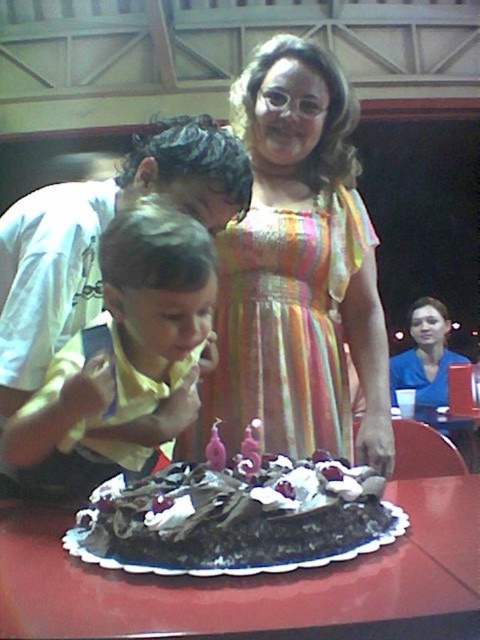
Question: Which point is closer to the camera taking this photo?

Choices:
 (A) (255, 90)
 (B) (216, 433)

Answer: (B)

Question: Estimate the real-world distances between objects in this image. Which object is farther from the matte yellow shirt at left?

Choices:
 (A) multicolored striped dress at center
 (B) chocolate cake at center
 (C) pink wax candle at center
 (D) chocolate frosted cake at center

Answer: (A)

Question: Which object is positioned farthest from the chocolate cake at center?

Choices:
 (A) pink wax candle at center
 (B) blue fabric shirt at center

Answer: (B)

Question: Where is chocolate cake at center located in relation to pink wax candle at center in the image?

Choices:
 (A) right
 (B) left

Answer: (A)

Question: Is chocolate cake at center positioned at the back of chocolate frosted cake at center?

Choices:
 (A) no
 (B) yes

Answer: (A)

Question: Where is chocolate cake at center located in relation to chocolate frosted cake at center in the image?

Choices:
 (A) below
 (B) above

Answer: (A)